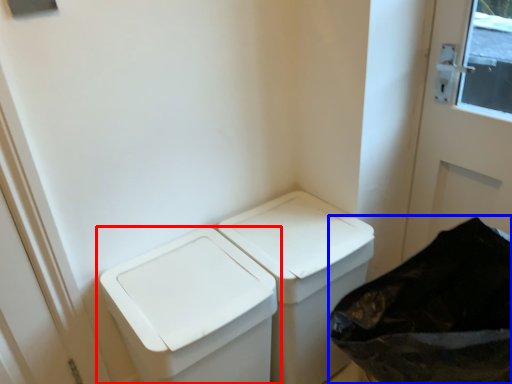
Question: Which object is further to the camera taking this photo, waste container (highlighted by a red box) or recycling bin (highlighted by a blue box)?

Choices:
 (A) waste container
 (B) recycling bin

Answer: (A)